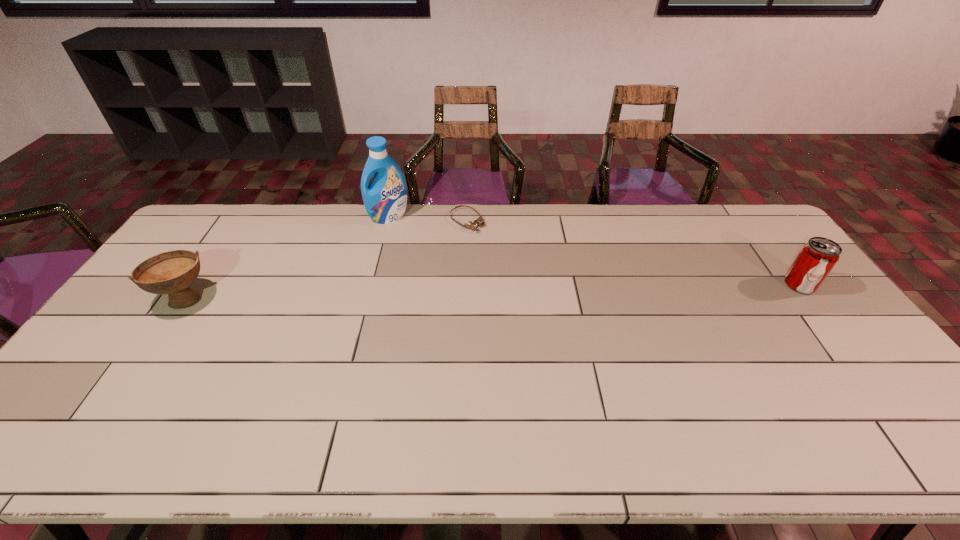
Where is `soup bowl`? soup bowl is located at coordinates (172, 273).

This screenshot has height=540, width=960. In order to click on the rightmost object in this screenshot , I will do `click(817, 257)`.

What are the coordinates of `the shortest object` in the screenshot? It's located at (471, 225).

Identify the location of the second object from right to left. (471, 225).

Find the location of a particular element. This screenshot has width=960, height=540. the third object from right to left is located at coordinates (385, 199).

Where is `detergent`? The width and height of the screenshot is (960, 540). detergent is located at coordinates (385, 199).

Identify the location of blank space located on the right of the soup bowl. The image size is (960, 540). (267, 299).

Identify the location of vacant space situated 0.370m on the back of the rightmost object. The image size is (960, 540). (741, 208).

Identify the location of free space located 0.150m on the front lenses and sides of the goggles. (504, 253).

Locate an element on the screen. This screenshot has height=540, width=960. free space located on the front lenses and sides of the goggles is located at coordinates (552, 292).